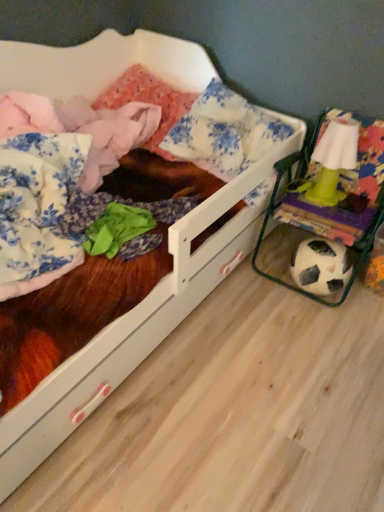
Where is `free location in front of green plastic lamp at right`? Image resolution: width=384 pixels, height=512 pixels. free location in front of green plastic lamp at right is located at coordinates (340, 209).